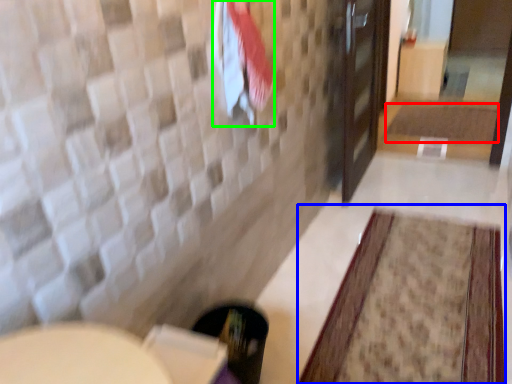
Question: Estimate the real-world distances between objects in this image. Which object is closer to bath mat (highlighted by a red box), bath mat (highlighted by a blue box) or beach towel (highlighted by a green box)?

Choices:
 (A) bath mat
 (B) beach towel

Answer: (A)